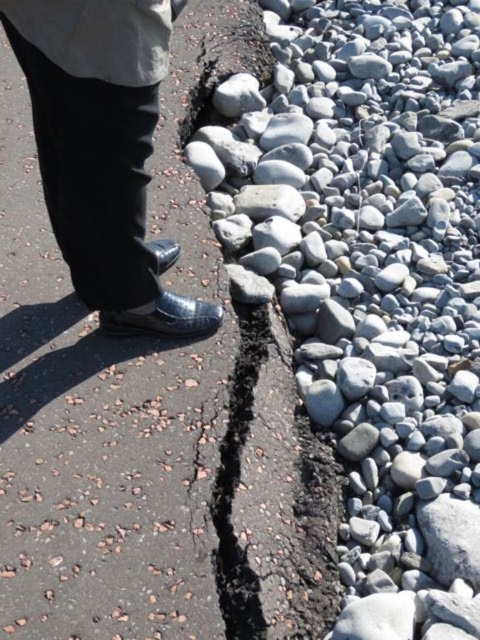
Question: Which object appears closest to the camera in this image?

Choices:
 (A) gray smooth rocks at right
 (B) black asphalt crack at center
 (C) shiny leather shoes at left
 (D) white fabric trench coat at upper left

Answer: (D)

Question: Based on their relative distances, which object is farther from the black asphalt crack at center?

Choices:
 (A) white fabric trench coat at upper left
 (B) gray smooth rocks at right
 (C) shiny leather shoes at left

Answer: (A)

Question: Does gray smooth rocks at right have a smaller size compared to shiny leather shoes at left?

Choices:
 (A) yes
 (B) no

Answer: (B)

Question: Which object is positioned closest to the gray smooth rocks at right?

Choices:
 (A) black asphalt crack at center
 (B) white fabric trench coat at upper left
 (C) shiny leather shoes at left

Answer: (A)

Question: Does gray smooth rocks at right appear over shiny leather shoes at left?

Choices:
 (A) yes
 (B) no

Answer: (A)

Question: Is black asphalt crack at center bigger than shiny leather shoes at left?

Choices:
 (A) yes
 (B) no

Answer: (A)